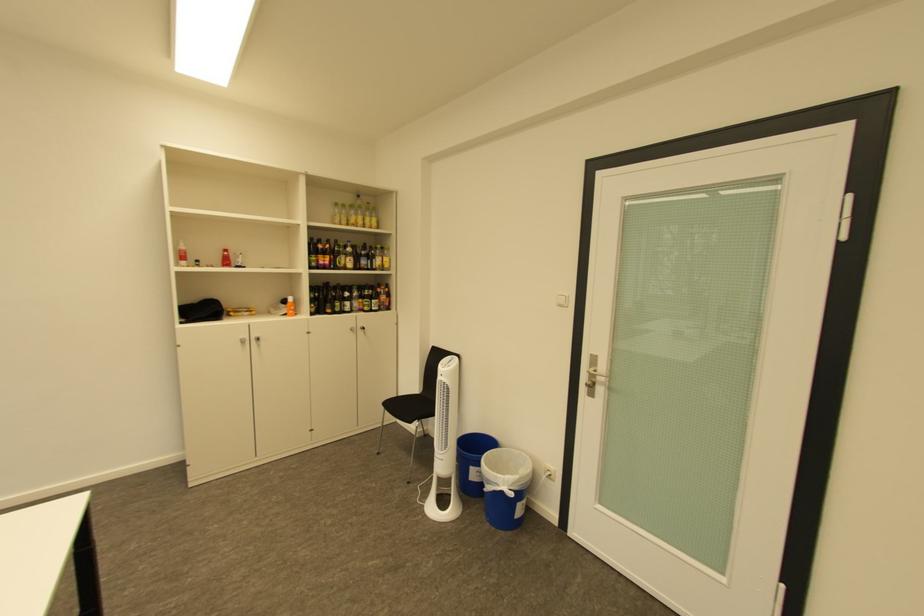
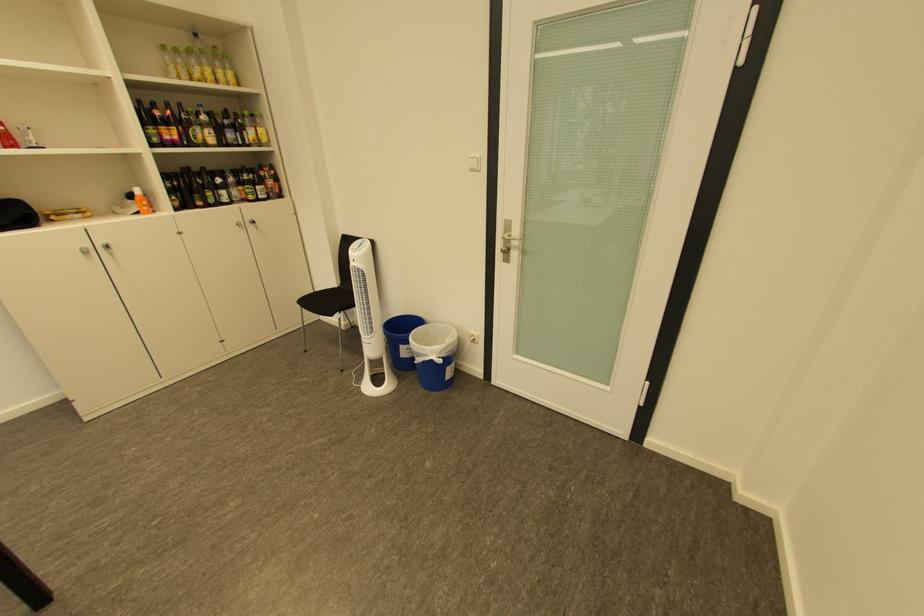
Locate, in the second image, the point that corresponds to point (454, 368) in the first image.

(363, 253)